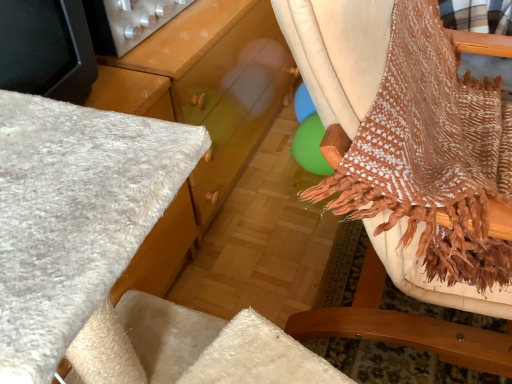
Question: Considering the relative positions of metallic silver knobs at upper left and brown woven fabric at right in the image provided, is metallic silver knobs at upper left to the left of brown woven fabric at right from the viewer's perspective?

Choices:
 (A) no
 (B) yes

Answer: (B)

Question: Does metallic silver knobs at upper left have a lesser width compared to brown woven fabric at right?

Choices:
 (A) no
 (B) yes

Answer: (B)

Question: From the image's perspective, does metallic silver knobs at upper left appear lower than brown woven fabric at right?

Choices:
 (A) no
 (B) yes

Answer: (A)

Question: From a real-world perspective, is metallic silver knobs at upper left located beneath brown woven fabric at right?

Choices:
 (A) yes
 (B) no

Answer: (B)

Question: Is brown woven fabric at right at the back of metallic silver knobs at upper left?

Choices:
 (A) yes
 (B) no

Answer: (B)

Question: Considering the relative sizes of metallic silver knobs at upper left and brown woven fabric at right in the image provided, is metallic silver knobs at upper left shorter than brown woven fabric at right?

Choices:
 (A) yes
 (B) no

Answer: (A)

Question: Is brown woven fabric at right positioned behind metallic silver knobs at upper left?

Choices:
 (A) yes
 (B) no

Answer: (B)

Question: Is brown woven fabric at right surrounding metallic silver knobs at upper left?

Choices:
 (A) yes
 (B) no

Answer: (B)

Question: Does brown woven fabric at right appear on the left side of metallic silver knobs at upper left?

Choices:
 (A) yes
 (B) no

Answer: (B)

Question: Could you tell me if brown woven fabric at right is facing metallic silver knobs at upper left?

Choices:
 (A) no
 (B) yes

Answer: (A)

Question: Is brown woven fabric at right taller than metallic silver knobs at upper left?

Choices:
 (A) no
 (B) yes

Answer: (B)

Question: Considering the relative sizes of brown woven fabric at right and metallic silver knobs at upper left in the image provided, is brown woven fabric at right thinner than metallic silver knobs at upper left?

Choices:
 (A) yes
 (B) no

Answer: (B)

Question: Choose the correct answer: Is metallic silver knobs at upper left inside brown woven fabric at right or outside it?

Choices:
 (A) outside
 (B) inside

Answer: (A)